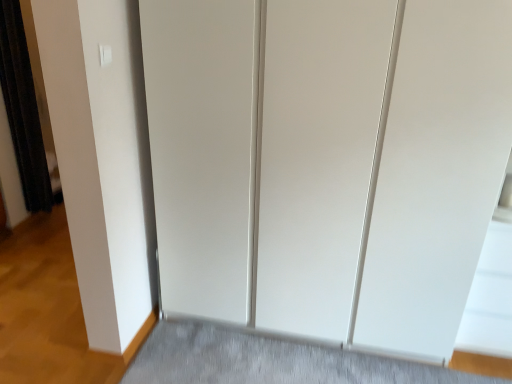
This screenshot has height=384, width=512. Describe the element at coordinates (347, 170) in the screenshot. I see `white matte door at center` at that location.

Where is `white matte door at center`? The width and height of the screenshot is (512, 384). white matte door at center is located at coordinates (347, 170).

You are a GUI agent. You are given a task and a screenshot of the screen. Output one action in this format:
    pyautogui.click(x=<x>, y=<y>)
    Task: Click on the white matte door at center
    Image resolution: width=512 pixels, height=384 pixels.
    Given the screenshot: What is the action you would take?
    pyautogui.click(x=347, y=170)